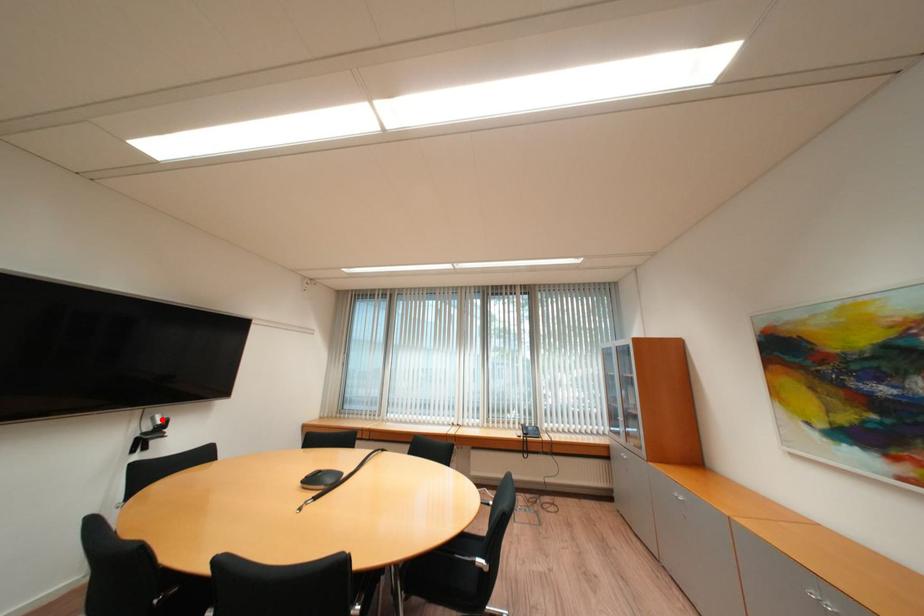
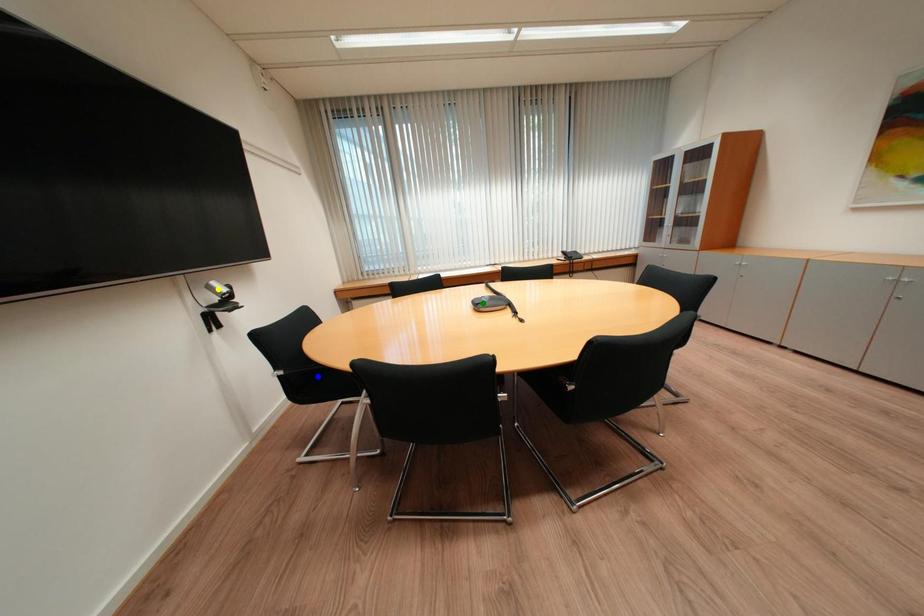
Question: I am providing you with two images of the same scene from different viewpoints. A red point is marked on the first image. You are given multiple points on the second image. In image 2, which mark is for the same physical point as the one in image 1?

Choices:
 (A) yellow point
 (B) green point
 (C) blue point

Answer: (A)